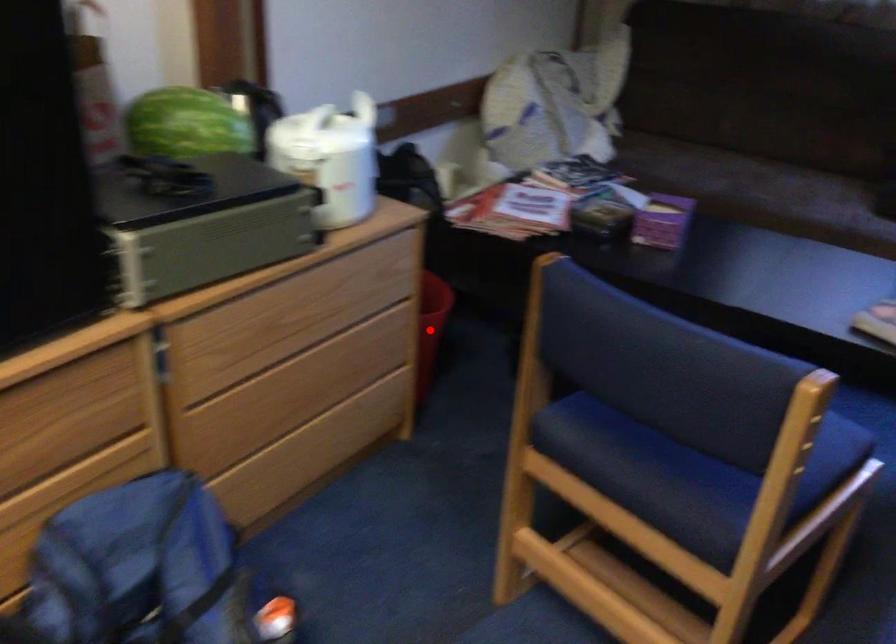
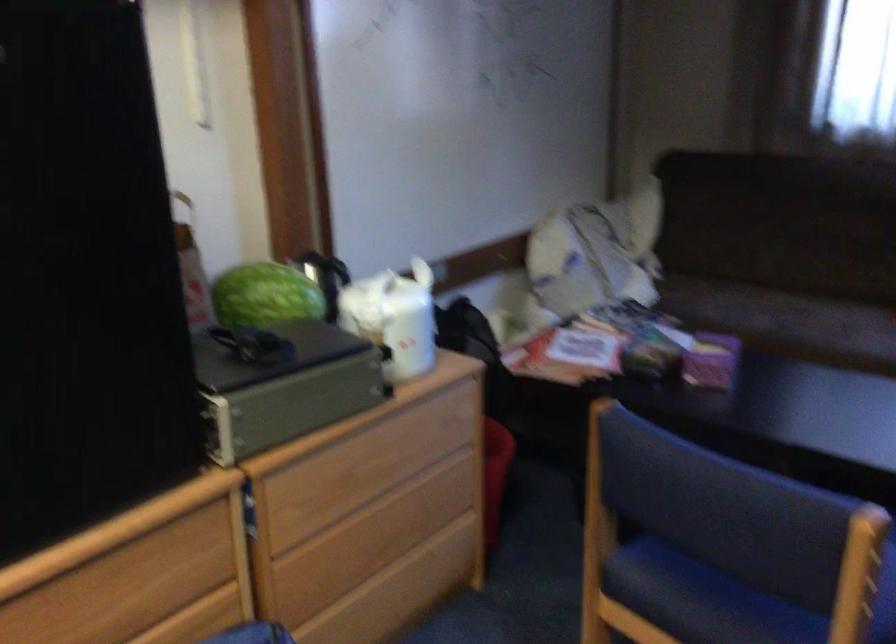
Find the pixel in the second image that matches the highlighted location in the first image.

(495, 474)